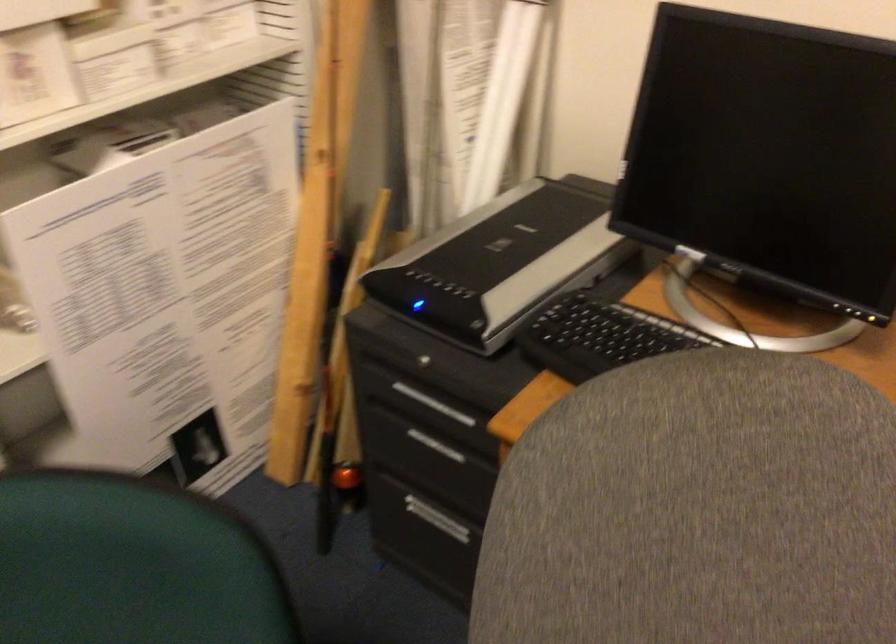
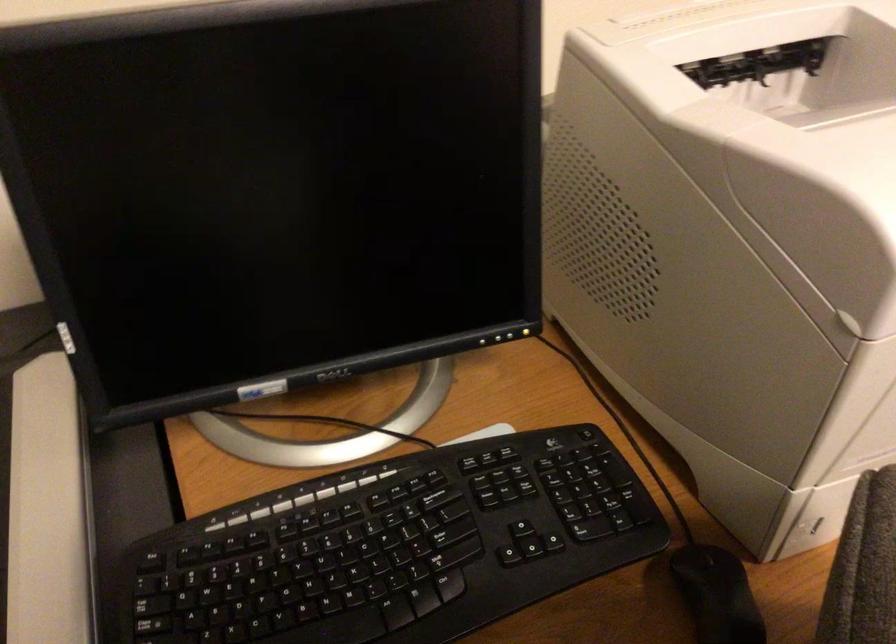
Locate, in the second image, the point that corresponds to point (815, 509) in the first image.

(717, 594)